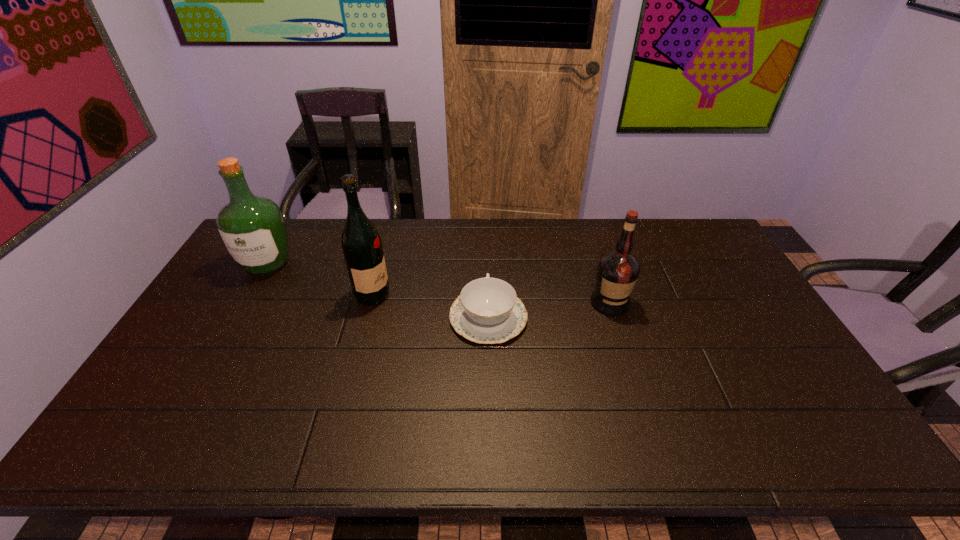
Choose which object is the second nearest neighbor to the second liquor from right to left. Please provide its 2D coordinates. Your answer should be formatted as a tuple, i.e. [(x, y)], where the tuple contains the x and y coordinates of a point satisfying the conditions above.

[(252, 227)]

The height and width of the screenshot is (540, 960). I want to click on the closest liquor to the third object from right to left, so tap(252, 227).

In order to click on the second closest liquor to the second liquor from left to right in this screenshot , I will do `click(617, 272)`.

Where is `free point that satisfies the following two spatial constraints: 1. on the front-facing side of the third object from right to left; 2. on the handle side of the chinaware`? free point that satisfies the following two spatial constraints: 1. on the front-facing side of the third object from right to left; 2. on the handle side of the chinaware is located at coordinates (367, 318).